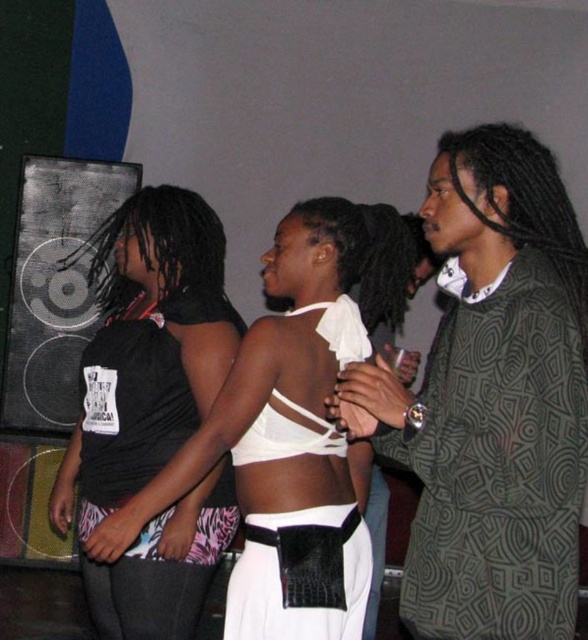
Is patterned fabric shirt at right to the right of black matte tank top at left from the viewer's perspective?

Indeed, patterned fabric shirt at right is positioned on the right side of black matte tank top at left.

In the scene shown: Can you confirm if patterned fabric shirt at right is thinner than black matte tank top at left?

Indeed, patterned fabric shirt at right has a lesser width compared to black matte tank top at left.

Is point (502, 211) positioned behind point (178, 442)?

No, it is not.

At what (x,y) coordinates should I click in order to perform the action: click on patterned fabric shirt at right. Please return your answer as a coordinate pair (x, y). Looking at the image, I should click on (492, 397).

Which is behind, point (201, 406) or point (278, 486)?

The point (201, 406) is behind.

Between point (109, 412) and point (345, 490), which one is positioned in front?

Positioned in front is point (345, 490).

The height and width of the screenshot is (640, 588). In order to click on black matte tank top at left in this screenshot , I will do `click(147, 349)`.

Is patterned fabric shirt at right smaller than white matte tank top at center?

Correct, patterned fabric shirt at right occupies less space than white matte tank top at center.

How distant is patterned fabric shirt at right from white matte tank top at center?

patterned fabric shirt at right and white matte tank top at center are 14.20 inches apart.

Locate an element on the screen. This screenshot has height=640, width=588. patterned fabric shirt at right is located at coordinates (492, 397).

Image resolution: width=588 pixels, height=640 pixels. Identify the location of patterned fabric shirt at right. (492, 397).